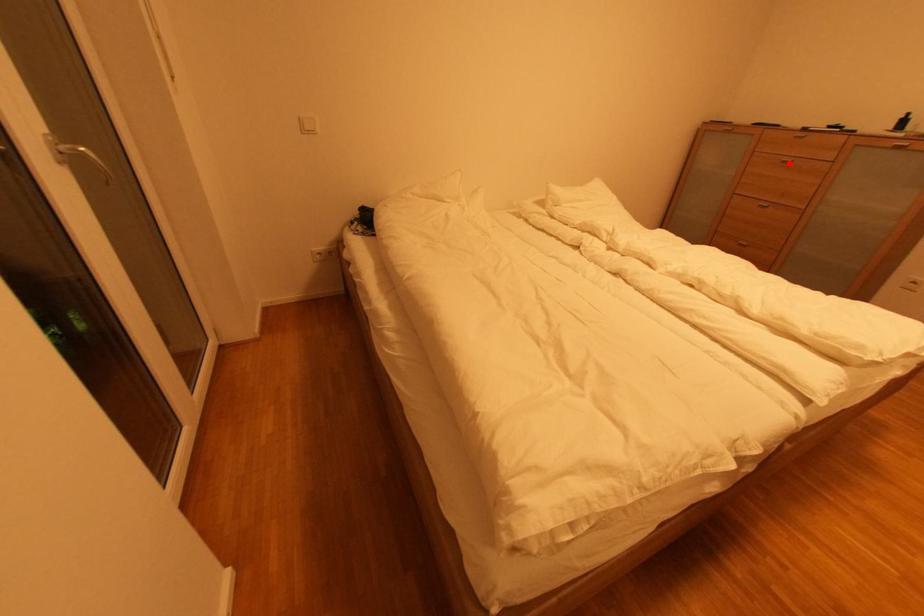
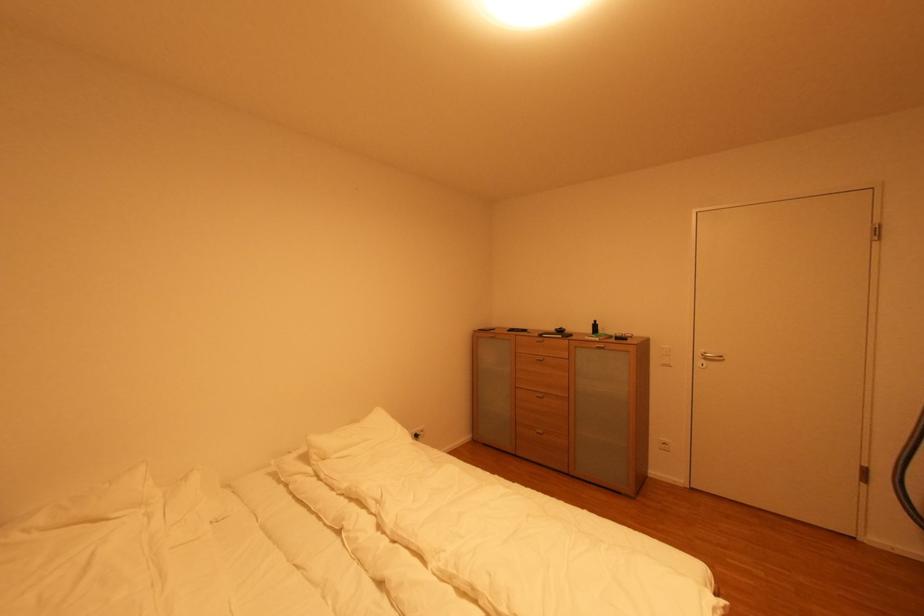
Where in the second image is the point corresponding to the highlighted location from the first image?

(543, 361)